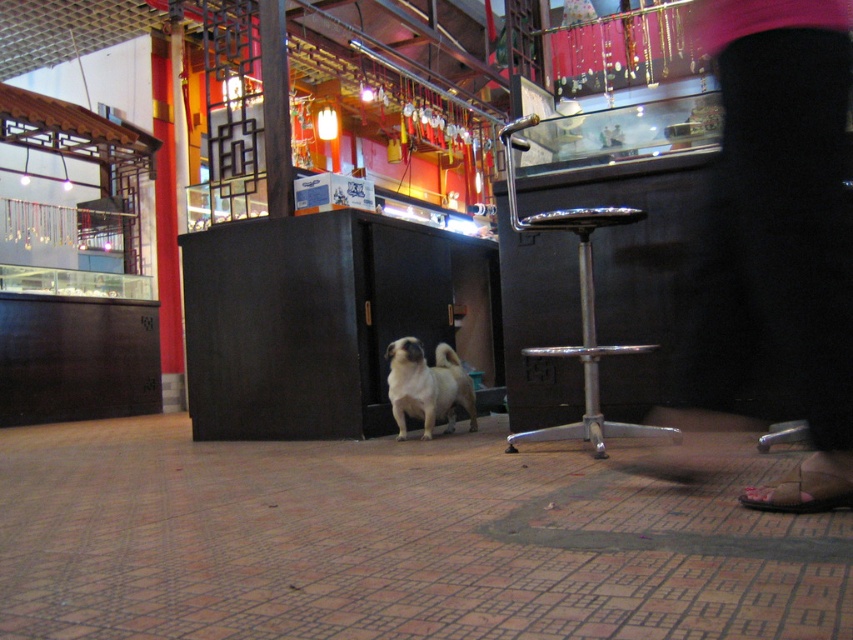
You are a customer in the shop and want to sit on the polished chrome bar stool at center. Where should you move relative to the light brown fur at center?

You should move to the right of the light brown fur at center to reach the polished chrome bar stool at center.